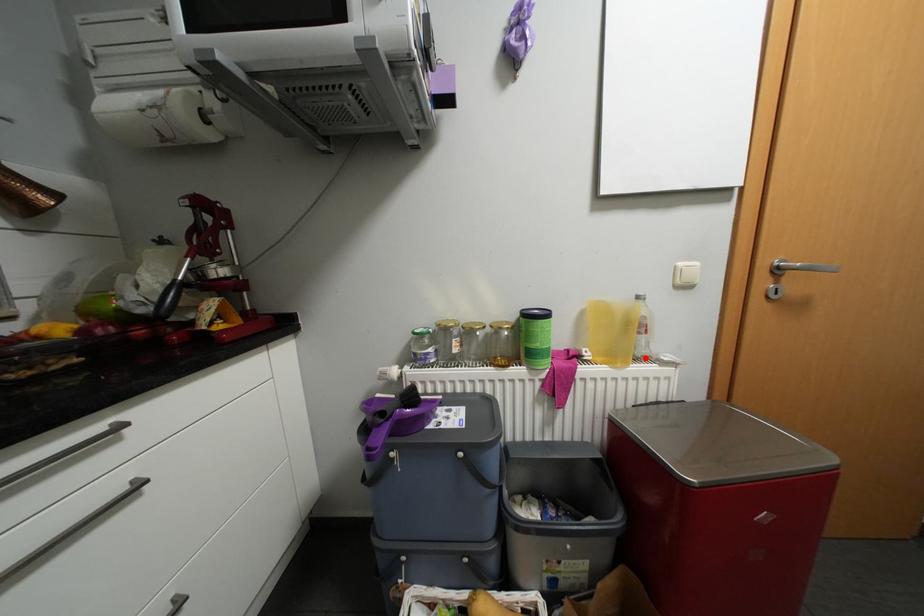
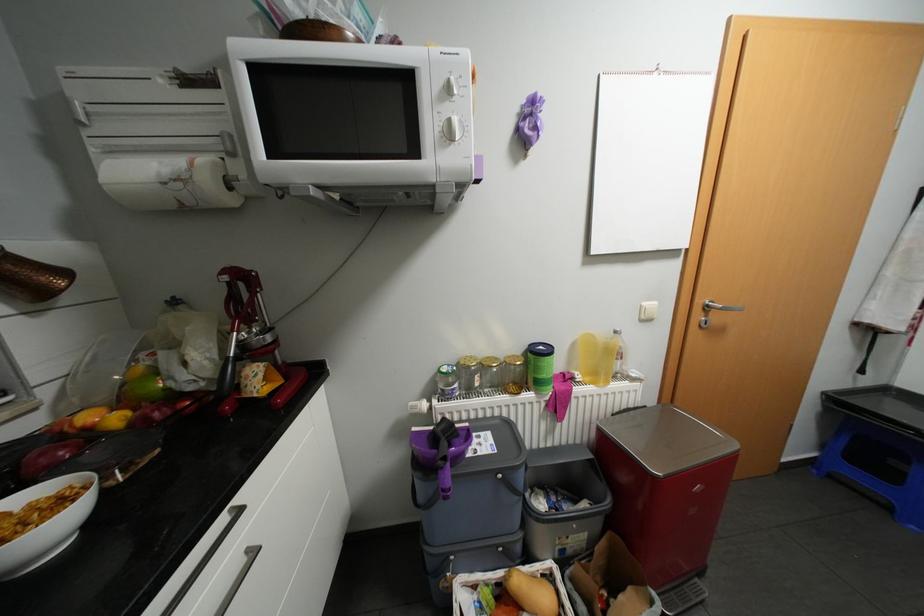
In the second image, find the point that corresponds to the highlighted location in the first image.

(622, 377)